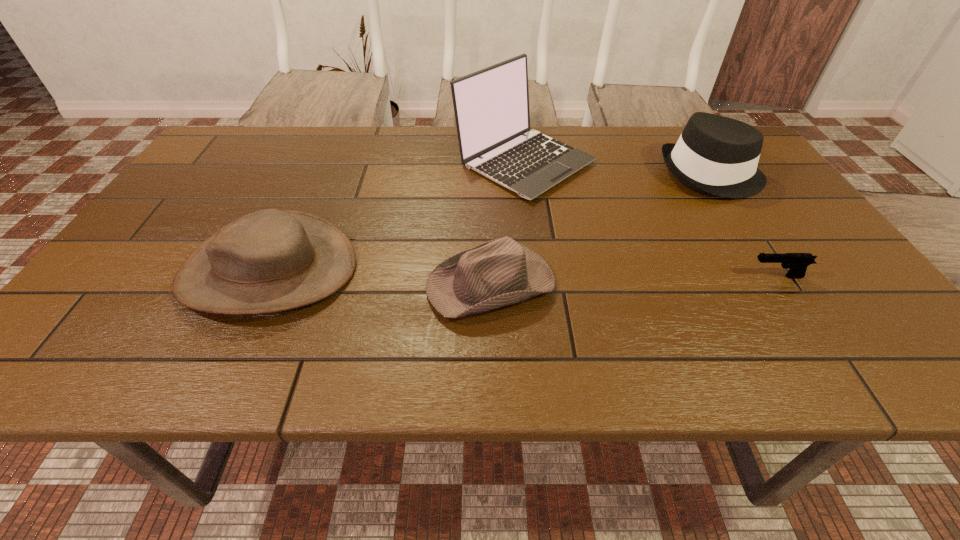
The image size is (960, 540). Find the location of `free location located 0.140m on the left of the second shortest object`. free location located 0.140m on the left of the second shortest object is located at coordinates (360, 284).

In order to click on vacant space located 0.390m on the front-facing side of the shortest object in this screenshot , I will do `click(564, 276)`.

Where is `free region located 0.060m on the front-facing side of the shortest object`? This screenshot has height=540, width=960. free region located 0.060m on the front-facing side of the shortest object is located at coordinates (719, 276).

What are the coordinates of `vacant space located 0.050m on the front-facing side of the shortest object` in the screenshot? It's located at (724, 276).

Image resolution: width=960 pixels, height=540 pixels. Find the location of `laptop_computer present at the far edge`. laptop_computer present at the far edge is located at coordinates (491, 106).

Image resolution: width=960 pixels, height=540 pixels. What are the coordinates of `fedora that is at the far edge` in the screenshot? It's located at (715, 155).

Locate an element on the screen. The height and width of the screenshot is (540, 960). object situated at the left edge is located at coordinates (272, 260).

Locate an element on the screen. fedora present at the right edge is located at coordinates (715, 155).

Find the location of a particular element. The width and height of the screenshot is (960, 540). pistol at the right edge is located at coordinates (797, 263).

Identify the location of object situated at the far right corner. This screenshot has height=540, width=960. (715, 155).